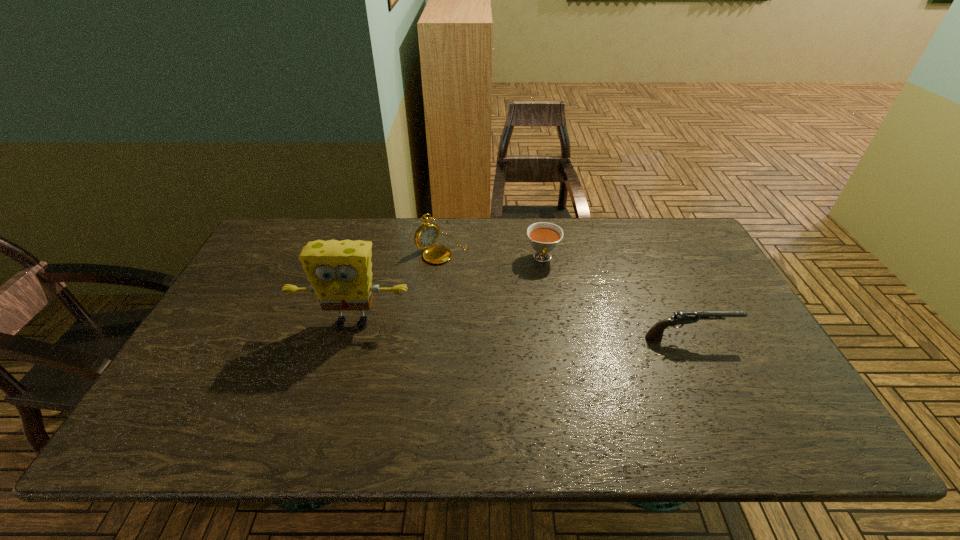
Where is `sponge`? Image resolution: width=960 pixels, height=540 pixels. sponge is located at coordinates (340, 274).

Locate an element on the screen. the rightmost object is located at coordinates (655, 333).

You are a GUI agent. You are given a task and a screenshot of the screen. Output one action in this format:
    pyautogui.click(x=<x>, y=<y>)
    Task: Click on the third shortest object
    The height and width of the screenshot is (540, 960).
    Given the screenshot: What is the action you would take?
    pyautogui.click(x=427, y=234)

Where is `the second object from right to left`? This screenshot has width=960, height=540. the second object from right to left is located at coordinates (544, 237).

Locate an element on the screen. vacant space located 0.080m on the face of the sponge is located at coordinates (340, 363).

I want to click on free location located aiming along the barrel of the gun, so click(x=756, y=338).

Locate an element on the screen. vacant region located on the face of the third shortest object is located at coordinates (537, 320).

At what (x,y) coordinates should I click in order to perform the action: click on free location located on the face of the third shortest object. Please return your answer as a coordinate pair (x, y). The height and width of the screenshot is (540, 960). Looking at the image, I should click on (518, 307).

The image size is (960, 540). In order to click on free space located 0.300m on the face of the third shortest object in this screenshot , I will do `click(526, 312)`.

Find the location of a particular element. The height and width of the screenshot is (540, 960). free spot located on the side of the teacup with the handle is located at coordinates (541, 332).